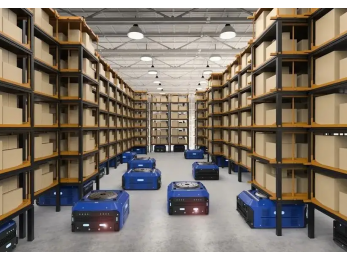
Locate an element on the screen. This screenshot has height=260, width=347. left side shelving unit is located at coordinates (85, 106).